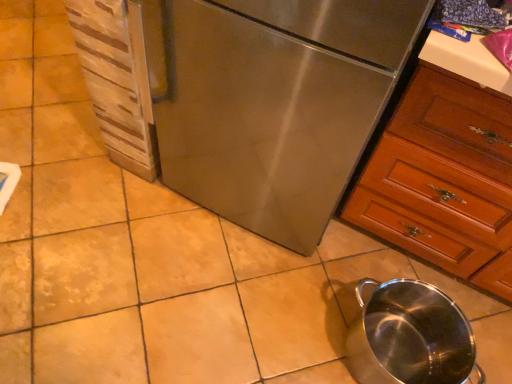
The width and height of the screenshot is (512, 384). Describe the element at coordinates (410, 336) in the screenshot. I see `shiny metallic crock pot at lower right` at that location.

What are the coordinates of `shiny metallic crock pot at lower right` in the screenshot? It's located at (410, 336).

Based on the photo, in order to face shiny metallic crock pot at lower right, should I rotate leftwards or rightwards?

Turn right approximately 18.341 degrees to face it.

This screenshot has width=512, height=384. Find the location of `shiny metallic crock pot at lower right`. shiny metallic crock pot at lower right is located at coordinates (410, 336).